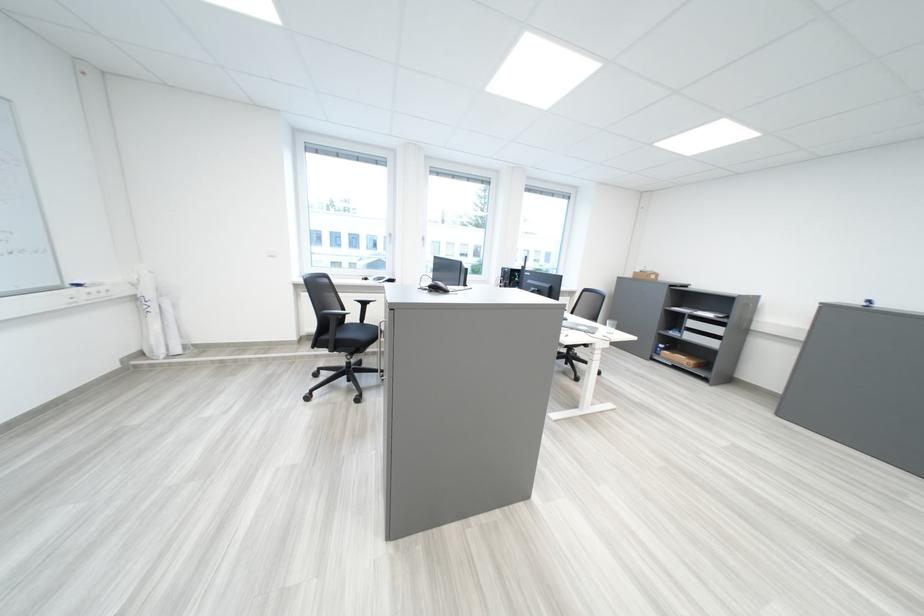
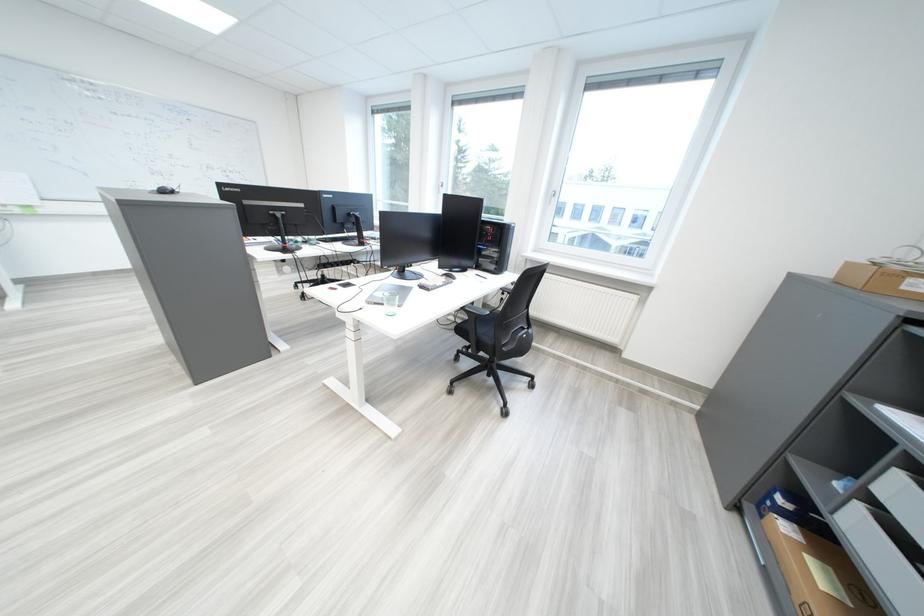
The point at [699,334] is marked in the first image. Where is the corresponding point in the second image?

(873, 509)